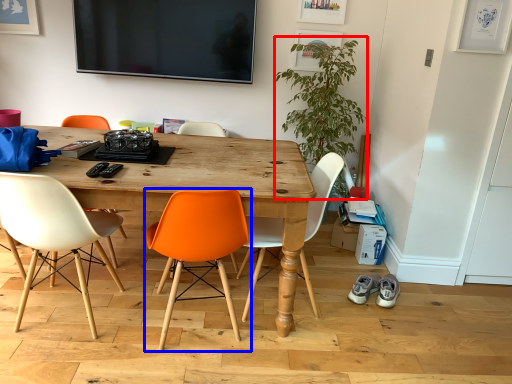
Question: Which of the following is the farthest to the observer, plant (highlighted by a red box) or chair (highlighted by a blue box)?

Choices:
 (A) plant
 (B) chair

Answer: (A)